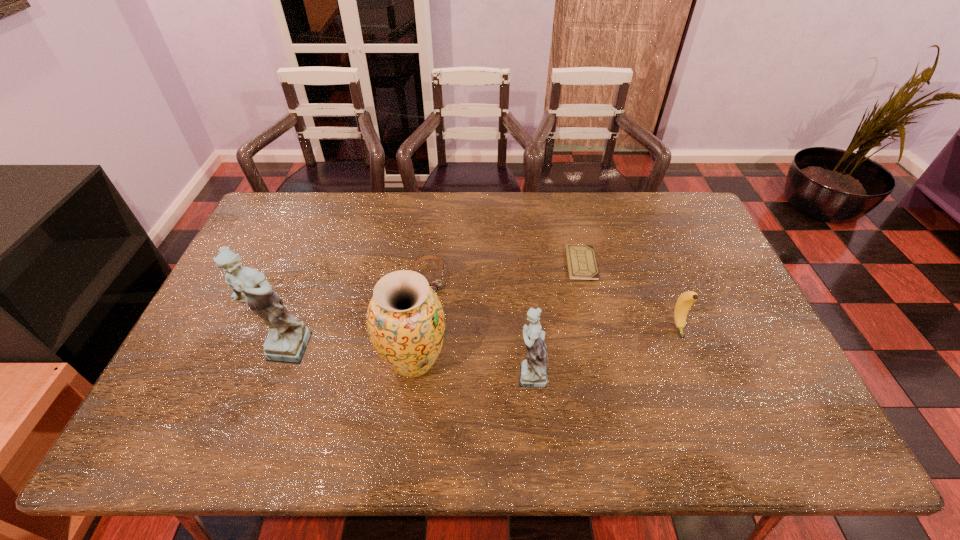
Identify the location of vacant space at the far edge of the desktop. The width and height of the screenshot is (960, 540). (324, 215).

In the image, there is a desktop. Where is `vacant space at the near edge`? vacant space at the near edge is located at coordinates (513, 408).

In the image, there is a desktop. Where is `vacant space at the far left corner`? vacant space at the far left corner is located at coordinates (306, 197).

Find the location of a particular element. free region at the near left corner of the desktop is located at coordinates (183, 400).

Image resolution: width=960 pixels, height=540 pixels. In the image, there is a desktop. Identify the location of vacant space at the far right corner. (650, 194).

Where is `empty space that is in between the fifth tallest object and the right figurine`? empty space that is in between the fifth tallest object and the right figurine is located at coordinates (479, 325).

Identify the location of vacant area that lies between the vase and the third object from right to left. (471, 367).

Where is `free space that is in between the right figurine and the fifth tallest object`? This screenshot has height=540, width=960. free space that is in between the right figurine and the fifth tallest object is located at coordinates (479, 325).

Find the location of a particular element. The width and height of the screenshot is (960, 540). vacant area that lies between the second shortest object and the fourth object from left to right is located at coordinates pyautogui.click(x=479, y=325).

The width and height of the screenshot is (960, 540). Identify the location of free space between the rightmost object and the left figurine. (480, 339).